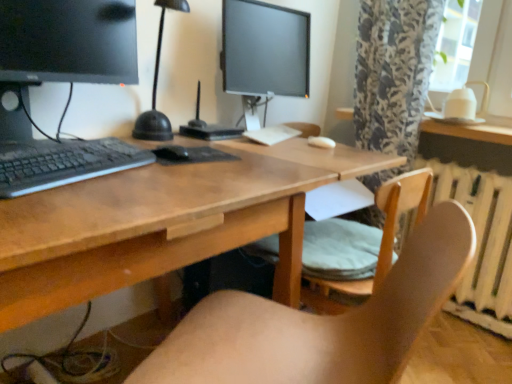
Find the location of a particular element. This screenshot has height=384, width=512. space that is in front of black matte keyboard at left is located at coordinates (68, 203).